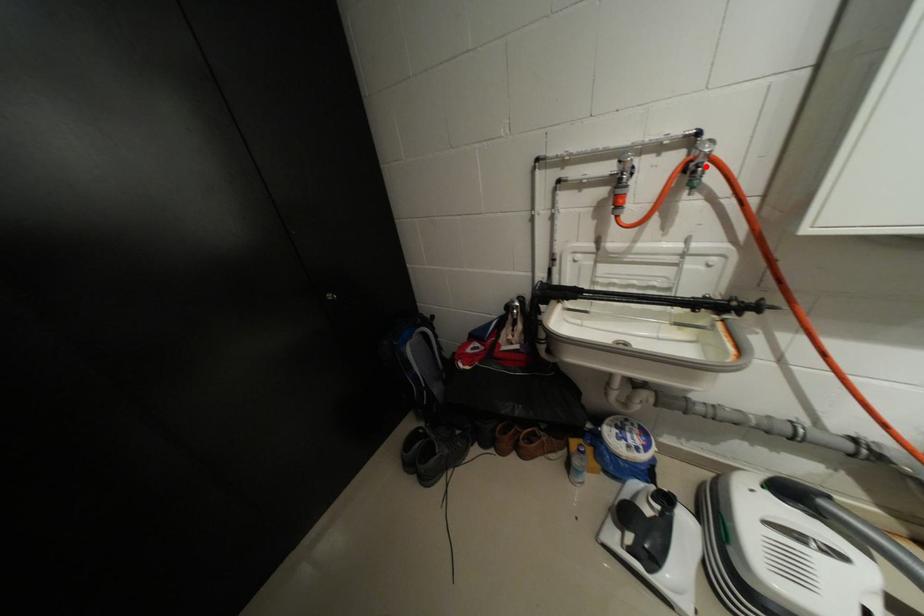
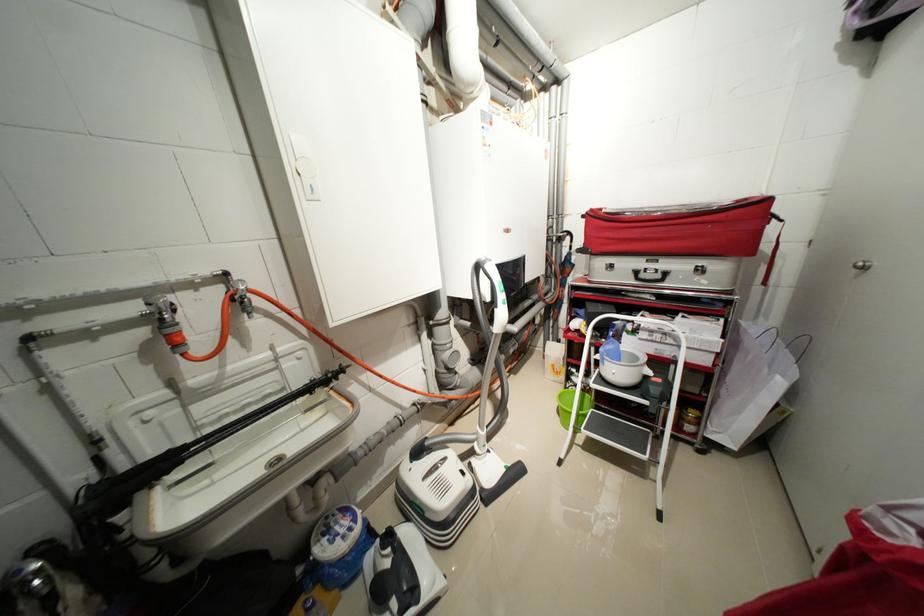
Locate, in the second image, the point that corresponds to the highlighted location in the first image.

(249, 299)